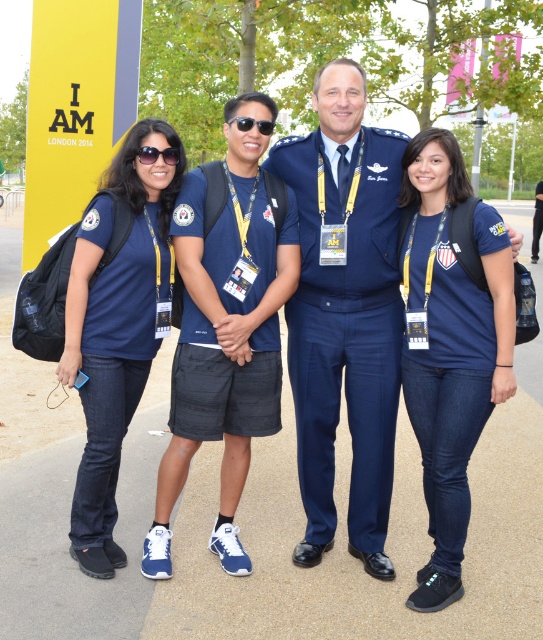
Question: From the image, what is the correct spatial relationship of navy blue uniform at center in relation to blue fabric uniform at center?

Choices:
 (A) left
 (B) right

Answer: (A)

Question: Which point is closer to the camera taking this photo?

Choices:
 (A) (166, 156)
 (B) (238, 316)
 (C) (535, 209)
 (D) (242, 116)

Answer: (B)

Question: Can you confirm if matte blue uniform at center is smaller than blue fabric uniform at center?

Choices:
 (A) no
 (B) yes

Answer: (B)

Question: In this image, where is matte blue t-shirt at lower right located relative to sunglasses at center?

Choices:
 (A) above
 (B) below

Answer: (B)

Question: Which of the following is the closest to the observer?

Choices:
 (A) (230, 371)
 (B) (178, 157)
 (C) (150, 236)

Answer: (A)

Question: Among these objects, which one is farthest from the camera?

Choices:
 (A) navy blue uniform at center
 (B) sunglasses at center
 (C) matte blue shirt at left

Answer: (A)